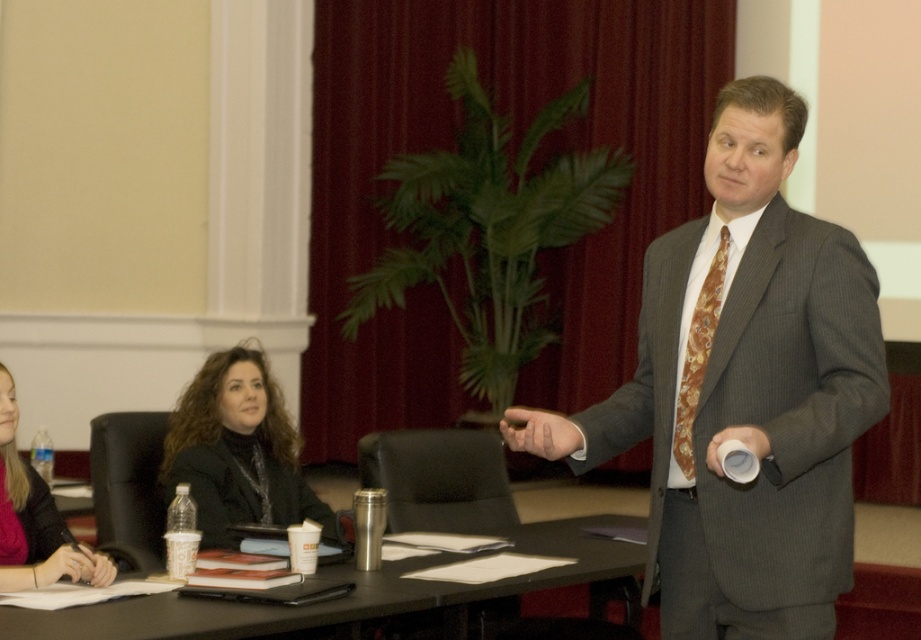
Does gray pinstripe suit at center lie in front of black leather jacket at center?

Yes, gray pinstripe suit at center is closer to the viewer.

Does point (663, 465) lie in front of point (223, 353)?

That is True.

Does point (627, 445) come closer to viewer compared to point (260, 353)?

Yes, point (627, 445) is closer to viewer.

Find the location of `gray pinstripe suit at center`. gray pinstripe suit at center is located at coordinates (742, 392).

Which is more to the left, black plastic table at lower center or matte black jacket at lower left?

Positioned to the left is matte black jacket at lower left.

Which is above, black plastic table at lower center or matte black jacket at lower left?

matte black jacket at lower left

Image resolution: width=921 pixels, height=640 pixels. Find the location of `black plastic table at lower center`. black plastic table at lower center is located at coordinates (346, 596).

Consider the image. Who is taller, black plastic table at lower center or brown silk tie at center?

With more height is brown silk tie at center.

Is black plastic table at lower center positioned before brown silk tie at center?

Yes, black plastic table at lower center is in front of brown silk tie at center.

The height and width of the screenshot is (640, 921). Identify the location of black plastic table at lower center. (346, 596).